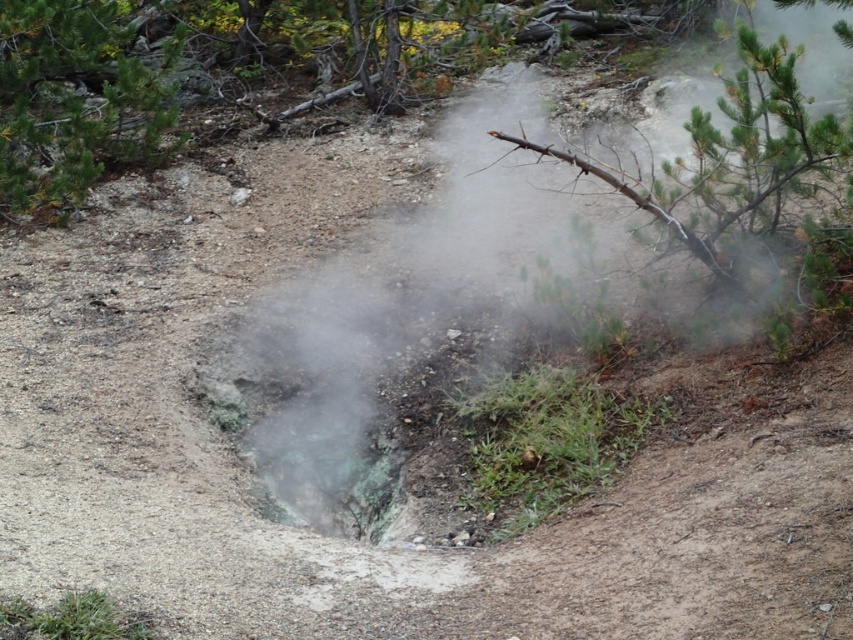
Does green pine tree at upper left come in front of green leafy branch at upper right?

No, it is not.

Which is above, green pine tree at upper left or green leafy branch at upper right?

green pine tree at upper left is higher up.

Is point (70, 92) less distant than point (689, 221)?

No, (70, 92) is behind (689, 221).

This screenshot has width=853, height=640. I want to click on green pine tree at upper left, so click(76, 100).